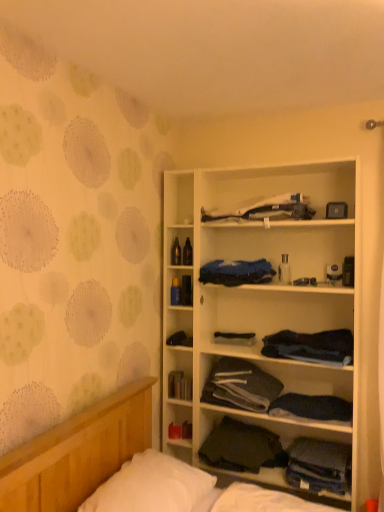
What do you see at coordinates (259, 291) in the screenshot? The image size is (384, 512). I see `white wood cabinet at center` at bounding box center [259, 291].

Find the location of a particular element. white fabric bag at upper center, the 8th clothing in the bottom-to-top sequence is located at coordinates (266, 209).

Image resolution: width=384 pixels, height=512 pixels. I want to click on dark gray fabric at center, positioned as the second clothing in bottom-to-top order, so click(x=242, y=447).

Image resolution: width=384 pixels, height=512 pixels. Identify the location of white wood cabinet at center. (259, 291).

Is black fabric at center, the 5th clothing ordered from the bottom, in contact with white soft pillow at lower left?

No, black fabric at center, the 5th clothing ordered from the bottom, is not beside white soft pillow at lower left.

Does black fabric at center, the 5th clothing ordered from the bottom, have a larger size compared to white soft pillow at lower left?

Actually, black fabric at center, the 5th clothing ordered from the bottom, might be smaller than white soft pillow at lower left.

Considering the relative sizes of black fabric at center, the 5th clothing ordered from the bottom, and white soft pillow at lower left in the image provided, is black fabric at center, the 5th clothing ordered from the bottom, thinner than white soft pillow at lower left?

Yes, black fabric at center, the 5th clothing ordered from the bottom, is thinner than white soft pillow at lower left.

Identify the location of the 3rd clothing positioned above the white soft pillow at lower left (from a real-world perspective). Image resolution: width=384 pixels, height=512 pixels. (180, 339).

From the image's perspective, is dark gray fabric at center, the eighth clothing when ordered from top to bottom, beneath white fabric bag at upper center, the 1th clothing positioned from the top?

Correct, dark gray fabric at center, the eighth clothing when ordered from top to bottom, appears lower than white fabric bag at upper center, the 1th clothing positioned from the top, in the image.

Is dark gray fabric at center, which is the first clothing in bottom-to-top order, wider than white fabric bag at upper center, the 8th clothing in the bottom-to-top sequence?

Indeed, dark gray fabric at center, which is the first clothing in bottom-to-top order, has a greater width compared to white fabric bag at upper center, the 8th clothing in the bottom-to-top sequence.

Considering the sizes of objects dark gray fabric at center, which is the first clothing in bottom-to-top order, and white fabric bag at upper center, the 1th clothing positioned from the top, in the image provided, who is bigger, dark gray fabric at center, which is the first clothing in bottom-to-top order, or white fabric bag at upper center, the 1th clothing positioned from the top,?

Bigger between the two is white fabric bag at upper center, the 1th clothing positioned from the top.

From a real-world perspective, is dark gray fabric at center, which is the first clothing in bottom-to-top order, under white fabric bag at upper center, the 8th clothing in the bottom-to-top sequence?

Correct, in the physical world, dark gray fabric at center, which is the first clothing in bottom-to-top order, is lower than white fabric bag at upper center, the 8th clothing in the bottom-to-top sequence.

Is dark blue fabric at center, which is the second clothing in top-to-bottom order, completely or partially inside dark blue fabric at center, the 6th clothing ordered from the bottom?

No, dark blue fabric at center, which is the second clothing in top-to-bottom order, is not a part of dark blue fabric at center, the 6th clothing ordered from the bottom.

Which of these two, dark blue fabric at center, the 6th clothing ordered from the bottom, or dark blue fabric at center, acting as the seventh clothing starting from the bottom, is smaller?

dark blue fabric at center, the 6th clothing ordered from the bottom.

Who is taller, dark blue fabric at center, the 6th clothing ordered from the bottom, or dark blue fabric at center, acting as the seventh clothing starting from the bottom?

dark blue fabric at center, acting as the seventh clothing starting from the bottom.

From a real-world perspective, is dark blue fabric at center, the 6th clothing ordered from the bottom, below dark blue fabric at center, which is the second clothing in top-to-bottom order?

Yes.

Is dark gray fabric at center, the eighth clothing when ordered from top to bottom, to the left or to the right of dark gray fabric at center, the seventh clothing viewed from the top, in the image?

Based on their positions, dark gray fabric at center, the eighth clothing when ordered from top to bottom, is located to the right of dark gray fabric at center, the seventh clothing viewed from the top.

Is dark gray fabric at center, the eighth clothing when ordered from top to bottom, touching dark gray fabric at center, the seventh clothing viewed from the top?

dark gray fabric at center, the eighth clothing when ordered from top to bottom, is not next to dark gray fabric at center, the seventh clothing viewed from the top, and they're not touching.

From a real-world perspective, is dark gray fabric at center, the eighth clothing when ordered from top to bottom, over dark gray fabric at center, the seventh clothing viewed from the top?

Actually, dark gray fabric at center, the eighth clothing when ordered from top to bottom, is physically below dark gray fabric at center, the seventh clothing viewed from the top, in the real world.

Can you confirm if white fabric bag at upper center, the 1th clothing positioned from the top, is bigger than dark gray fabric at center, which is the first clothing in bottom-to-top order?

Indeed, white fabric bag at upper center, the 1th clothing positioned from the top, has a larger size compared to dark gray fabric at center, which is the first clothing in bottom-to-top order.

Find the location of `clothing that is the 7th one above the dark gray fabric at center, which is the first clothing in bottom-to-top order (from a real-world perspective)`. clothing that is the 7th one above the dark gray fabric at center, which is the first clothing in bottom-to-top order (from a real-world perspective) is located at coordinates (266, 209).

Does white fabric bag at upper center, the 1th clothing positioned from the top, have a lesser height compared to dark gray fabric at center, the eighth clothing when ordered from top to bottom?

Yes.

From a real-world perspective, is matte black book at center beneath dark gray fabric at center, the 4th clothing in the bottom-to-top sequence?

Indeed, from a real-world perspective, matte black book at center is positioned beneath dark gray fabric at center, the 4th clothing in the bottom-to-top sequence.

From the image's perspective, is matte black book at center positioned above or below dark gray fabric at center, which is counted as the 5th clothing, starting from the top?

matte black book at center is situated lower than dark gray fabric at center, which is counted as the 5th clothing, starting from the top, in the image.

Who is more distant, matte black book at center or dark gray fabric at center, which is counted as the 5th clothing, starting from the top?

Positioned behind is matte black book at center.

What's the angular difference between matte black book at center and dark gray fabric at center, which is counted as the 5th clothing, starting from the top,'s facing directions?

The facing directions of matte black book at center and dark gray fabric at center, which is counted as the 5th clothing, starting from the top, are 2.91 degrees apart.

From a real-world perspective, is white soft pillow at lower left located higher than matte black book at center?

Incorrect, from a real-world perspective, white soft pillow at lower left is lower than matte black book at center.

Is white soft pillow at lower left not near matte black book at center?

They are positioned close to each other.

Looking at the image, does white soft pillow at lower left seem bigger or smaller compared to matte black book at center?

In the image, white soft pillow at lower left appears to be larger than matte black book at center.

Based on the photo, is white soft pillow at lower left further to camera compared to matte black book at center?

That is False.

The height and width of the screenshot is (512, 384). Find the location of `pillow on the left side of black fabric at center, the 5th clothing ordered from the bottom`. pillow on the left side of black fabric at center, the 5th clothing ordered from the bottom is located at coordinates (151, 486).

Identify the location of the 7th clothing below the white fabric bag at upper center, the 8th clothing in the bottom-to-top sequence (from the image's perspective). The width and height of the screenshot is (384, 512). (319, 466).

From the picture: When comparing their distances from dark blue fabric at center, which ranks as the third clothing in bottom-to-top order, does matte black book at center or dark blue fabric at center, which is the second clothing in top-to-bottom order, seem closer?

matte black book at center lies closer to dark blue fabric at center, which ranks as the third clothing in bottom-to-top order, than the other object.

Based on their spatial positions, is white soft pillow at lower left or dark blue fabric at center, which is the second clothing in top-to-bottom order, further from dark blue fabric at center, the 3th clothing from the top?

white soft pillow at lower left is positioned further to the anchor dark blue fabric at center, the 3th clothing from the top.

Looking at the image, which one is located closer to matte black book at center, black fabric at center, the 4th clothing in the top-to-bottom sequence, or dark gray fabric at center, positioned as the second clothing in bottom-to-top order?

Among the two, black fabric at center, the 4th clothing in the top-to-bottom sequence, is located nearer to matte black book at center.

From the image, which object appears to be farther from matte black book at center, black fabric at center, the 4th clothing in the top-to-bottom sequence, or dark blue fabric at center, the 3th clothing from the top?

dark blue fabric at center, the 3th clothing from the top.

Which object lies further to the anchor point dark gray fabric at center, which is the first clothing in bottom-to-top order, white soft pillow at lower left or dark blue fabric at center, the 6th clothing ordered from the bottom?

white soft pillow at lower left is further to dark gray fabric at center, which is the first clothing in bottom-to-top order.

Considering their positions, is white fabric bag at upper center, the 1th clothing positioned from the top, positioned further to dark blue fabric at center, the 6th clothing ordered from the bottom, than white wood cabinet at center?

Based on the image, white fabric bag at upper center, the 1th clothing positioned from the top, appears to be further to dark blue fabric at center, the 6th clothing ordered from the bottom.

When comparing their distances from dark blue fabric at center, the 6th clothing ordered from the bottom, does dark blue fabric at center, which appears as the sixth clothing when viewed from the top, or white wood cabinet at center seem further?

The object further to dark blue fabric at center, the 6th clothing ordered from the bottom, is white wood cabinet at center.

Which object lies further to the anchor point dark blue fabric at center, which appears as the sixth clothing when viewed from the top, dark gray fabric at center, which is the first clothing in bottom-to-top order, or matte black book at center?

The object further to dark blue fabric at center, which appears as the sixth clothing when viewed from the top, is matte black book at center.

This screenshot has height=512, width=384. I want to click on cabinetry that lies between dark blue fabric at center, which is the second clothing in top-to-bottom order, and dark gray fabric at center, the seventh clothing viewed from the top, from top to bottom, so click(259, 291).

The image size is (384, 512). In order to click on cabinetry located between white soft pillow at lower left and dark gray fabric at center, the 4th clothing in the bottom-to-top sequence, in the depth direction in this screenshot , I will do `click(259, 291)`.

What are the coordinates of `cabinetry located between matte black book at center and dark gray fabric at center, which is the first clothing in bottom-to-top order, in the left-right direction` in the screenshot? It's located at (259, 291).

Where is `cabinetry situated between white soft pillow at lower left and dark blue fabric at center, which ranks as the third clothing in bottom-to-top order, from left to right`? This screenshot has width=384, height=512. cabinetry situated between white soft pillow at lower left and dark blue fabric at center, which ranks as the third clothing in bottom-to-top order, from left to right is located at coordinates (259, 291).